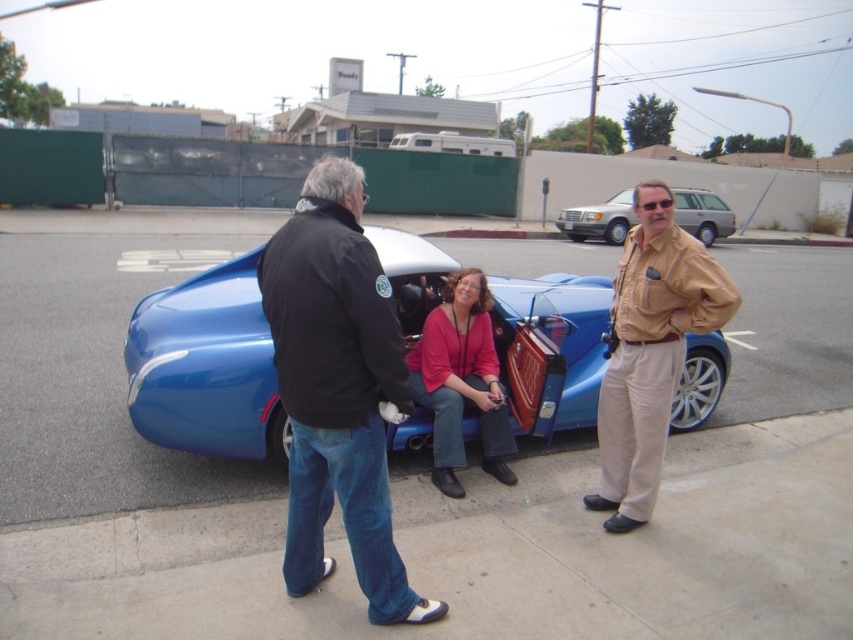
Question: Does shiny metallic car at center have a lesser width compared to matte pink sweater at center?

Choices:
 (A) no
 (B) yes

Answer: (A)

Question: Does black leather jacket at center come in front of matte pink sweater at center?

Choices:
 (A) yes
 (B) no

Answer: (A)

Question: Which object is closer to the camera taking this photo?

Choices:
 (A) silver metallic suv at upper right
 (B) matte pink sweater at center
 (C) black leather jacket at center
 (D) shiny metallic car at center

Answer: (C)

Question: Which point appears farthest from the camera in this image?

Choices:
 (A) (685, 211)
 (B) (457, 282)
 (C) (241, 381)
 (D) (618, 353)

Answer: (A)

Question: Which object appears closest to the camera in this image?

Choices:
 (A) silver metallic suv at upper right
 (B) matte pink sweater at center

Answer: (B)

Question: From the image, what is the correct spatial relationship of shiny metallic car at center in relation to matte pink sweater at center?

Choices:
 (A) left
 (B) right

Answer: (B)